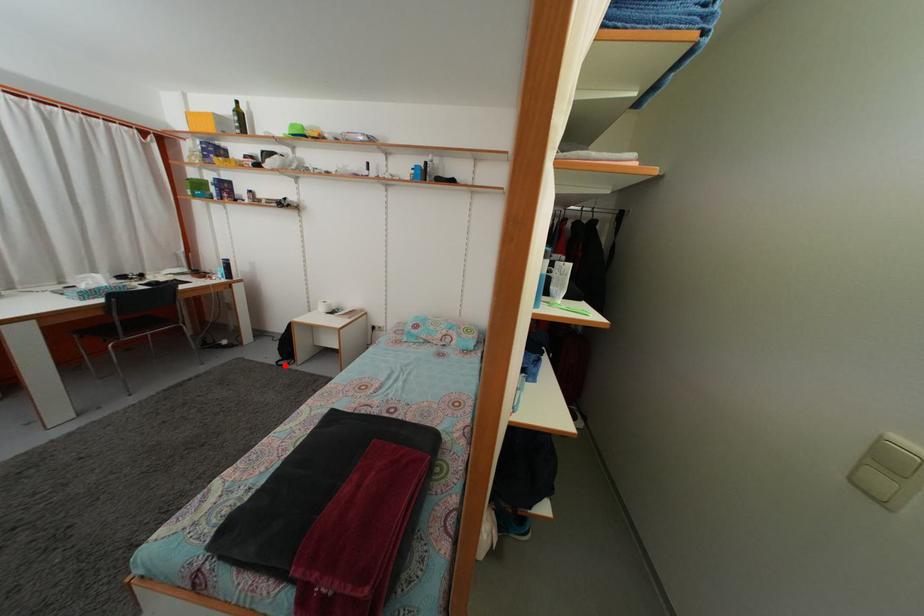
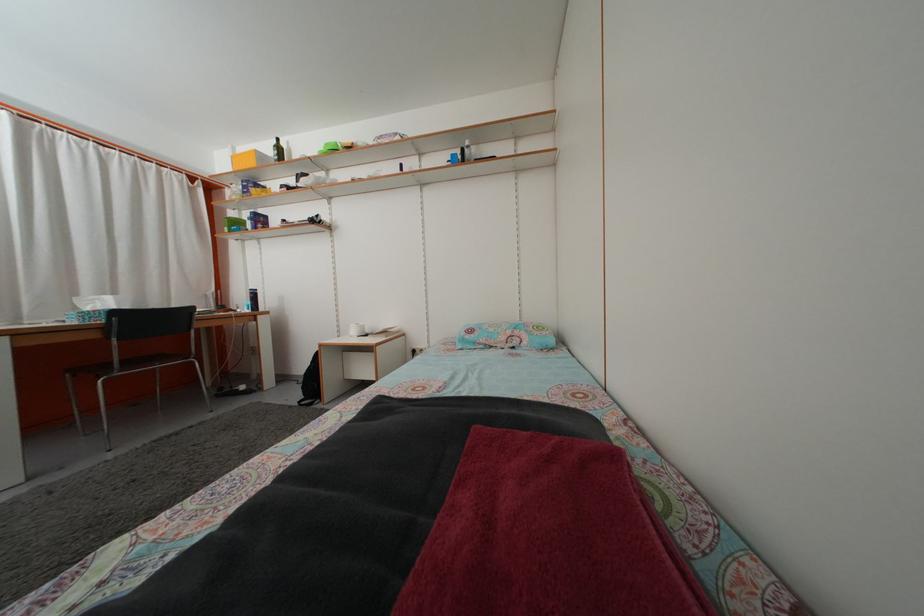
Question: A red point is marked in image1. In image2, is the corresponding 3D point closer to the camera or farther? Reply with the corresponding letter.

Choices:
 (A) The corresponding 3D point is closer.
 (B) The corresponding 3D point is farther.

Answer: (A)